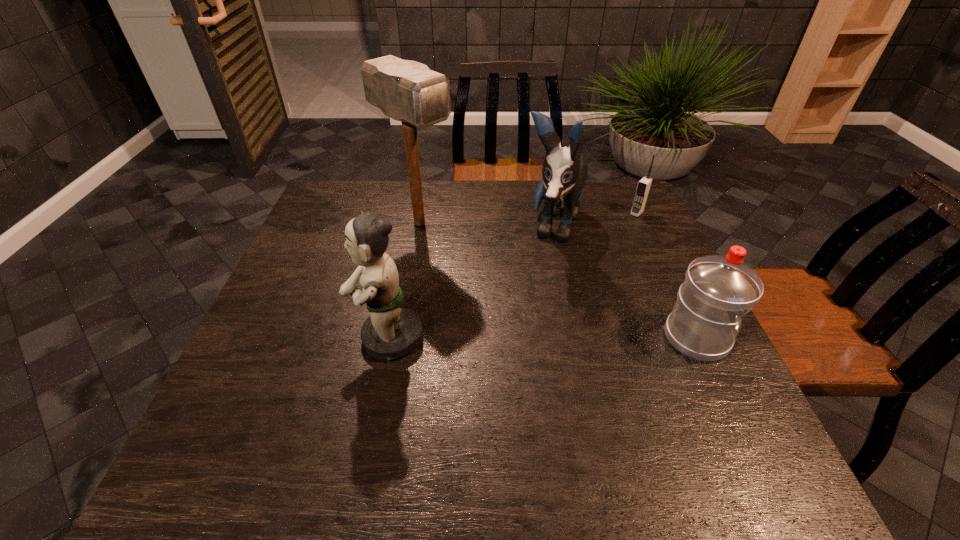
Where is `free space located 0.190m on the front-facing side of the puppy`? This screenshot has width=960, height=540. free space located 0.190m on the front-facing side of the puppy is located at coordinates (527, 309).

Where is `free space located 0.130m on the front-facing side of the puppy`? free space located 0.130m on the front-facing side of the puppy is located at coordinates (534, 293).

You are a GUI agent. You are given a task and a screenshot of the screen. Output one action in this format:
    pyautogui.click(x=<x>, y=<y>)
    Task: Click on the vacant space situated on the front-facing side of the cellular telephone
    
    Given the screenshot: What is the action you would take?
    pyautogui.click(x=625, y=225)

You are a GUI agent. You are given a task and a screenshot of the screen. Output one action in this format:
    pyautogui.click(x=<x>, y=<y>)
    Task: Click on the free region located 0.150m on the front-facing side of the cellular telephone
    
    Given the screenshot: What is the action you would take?
    pyautogui.click(x=611, y=240)

Image resolution: width=960 pixels, height=540 pixels. I want to click on vacant area situated 0.360m on the front-facing side of the cellular telephone, so click(x=573, y=278).

This screenshot has height=540, width=960. Find the location of `vacant region located 0.180m on the striking face of the mallet`. vacant region located 0.180m on the striking face of the mallet is located at coordinates (488, 270).

I want to click on free space located on the striking face of the mallet, so click(x=513, y=287).

At what (x,y) coordinates should I click in order to perform the action: click on free space located 0.300m on the striking face of the mallet. Please return your answer as a coordinate pair (x, y). The width and height of the screenshot is (960, 540). Looking at the image, I should click on (521, 294).

Image resolution: width=960 pixels, height=540 pixels. What are the coordinates of `puppy that is at the far edge` in the screenshot? It's located at (564, 173).

Where is `cellular telephone that is at the far edge`? cellular telephone that is at the far edge is located at coordinates (643, 188).